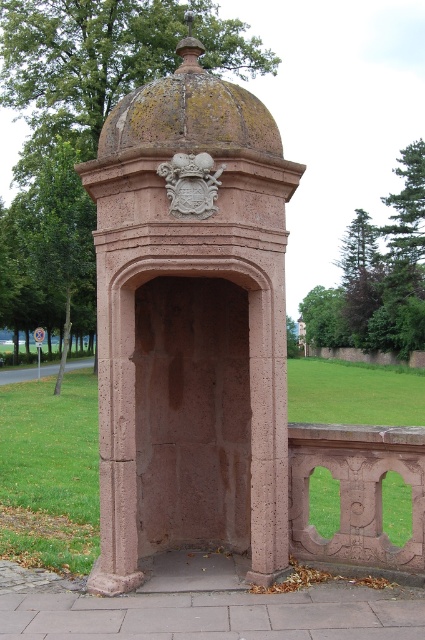
Question: Which object appears closest to the camera in this image?

Choices:
 (A) rusty stone dome at upper center
 (B) rustic stone gazebo at center

Answer: (B)

Question: Can you confirm if rustic stone gazebo at center is positioned to the right of rusty stone dome at upper center?

Choices:
 (A) yes
 (B) no

Answer: (B)

Question: Which point is closer to the camera?

Choices:
 (A) rustic stone gazebo at center
 (B) rusty stone dome at upper center

Answer: (A)

Question: Does rustic stone gazebo at center appear on the left side of rusty stone dome at upper center?

Choices:
 (A) yes
 (B) no

Answer: (A)

Question: Is rustic stone gazebo at center further to the viewer compared to rusty stone dome at upper center?

Choices:
 (A) no
 (B) yes

Answer: (A)